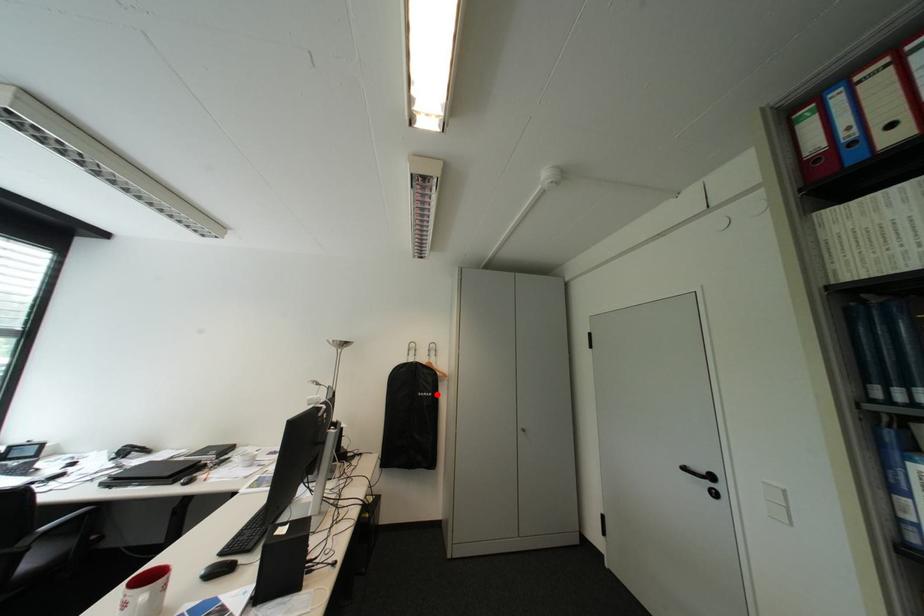
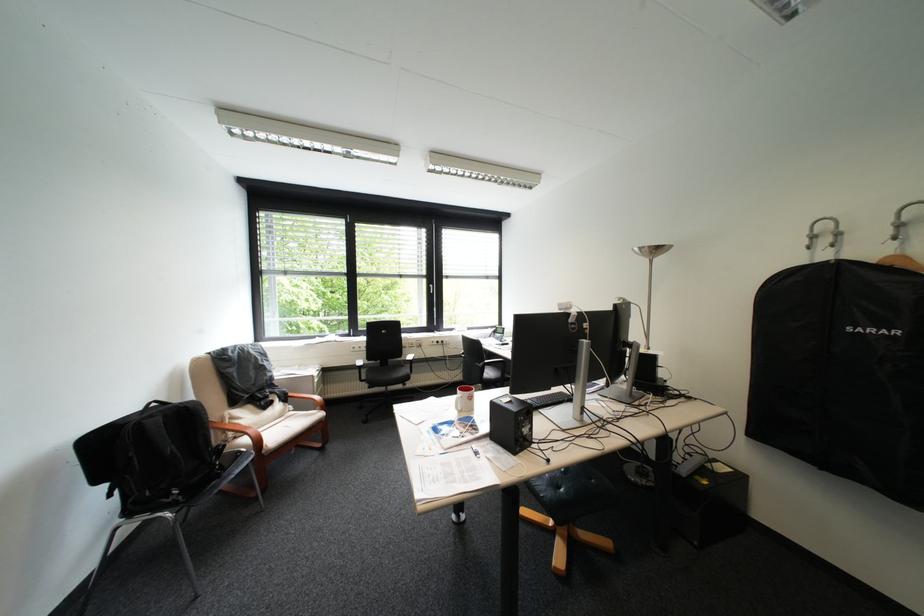
Locate, in the second image, the point that corresponds to the highlighted location in the first image.

(883, 331)